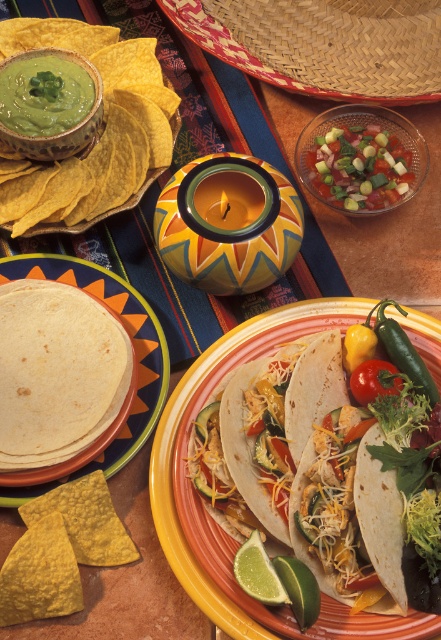
You are setting up a food stall and need to place a decorative item between the chopped green vegetables at center and the woven straw sombrero at upper center. Given that the space between them is 4.41 inches, can a 3.5 inch wide decorative plate fit there?

The distance between the chopped green vegetables at center and the woven straw sombrero at upper center is 4.41 inches. Since the decorative plate is 3.5 inches wide, it can fit within the available space as 3.5 is less than 4.41.

You are setting up a food stall and need to decide which item to place first based on size. Given that you have a matte yellow tortilla at upper left and a green matte bowl at upper left, which item should you place first if you want to start with the larger item?

The matte yellow tortilla at upper left has a larger size compared to the green matte bowl at upper left, so you should place the matte yellow tortilla at upper left first.

From the picture: You are a food stylist arranging the Mexican spread. You need to place a decorative plate that is 10 cm tall. Can the white tortilla at center and the green matte lime at lower center fit vertically on this plate without overlapping?

The white tortilla at center is much taller than the green matte lime at lower center. Since the decorative plate is only 10 cm tall, both items combined would exceed the plate height, so they cannot fit without overlapping.